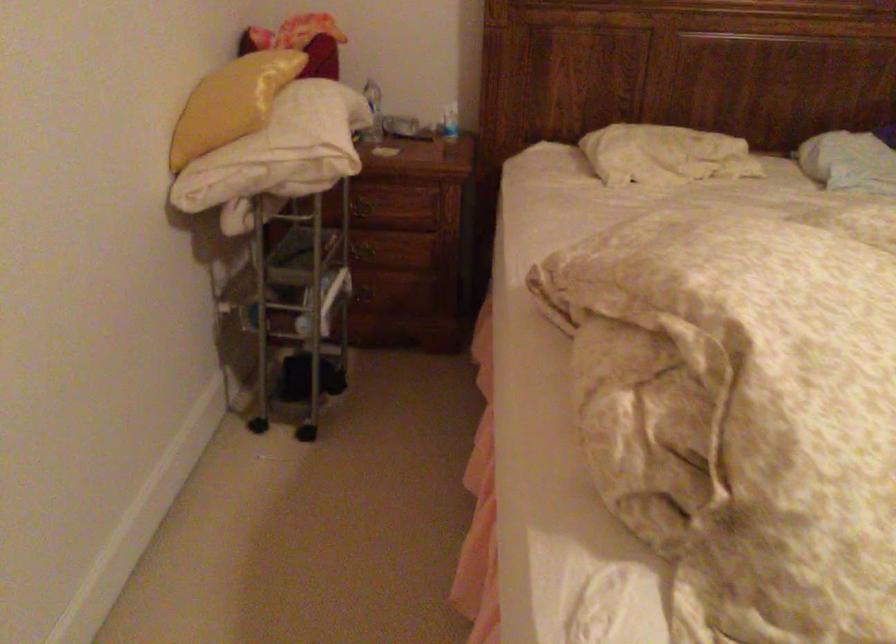
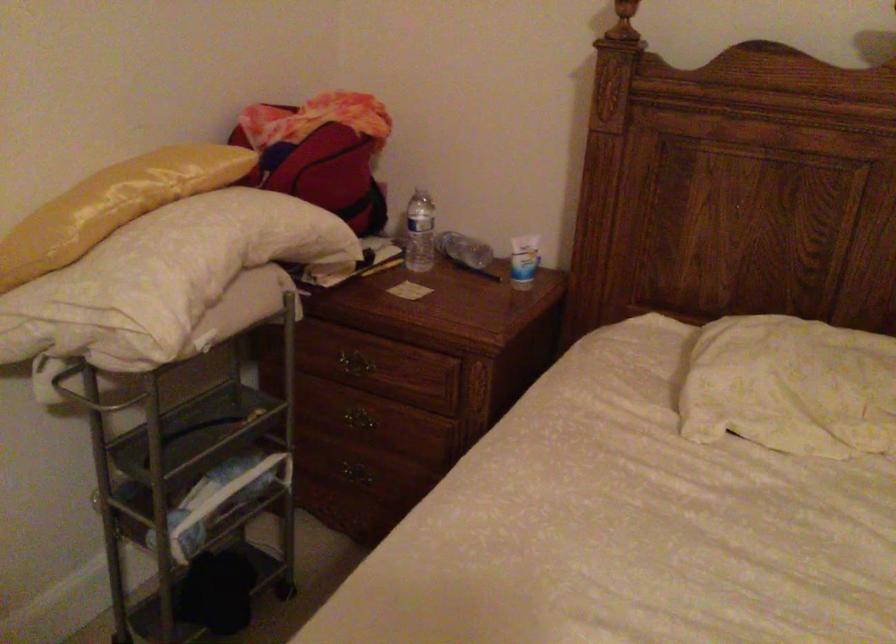
Locate, in the second image, the point that corresponds to (270,91) in the first image.

(113, 205)